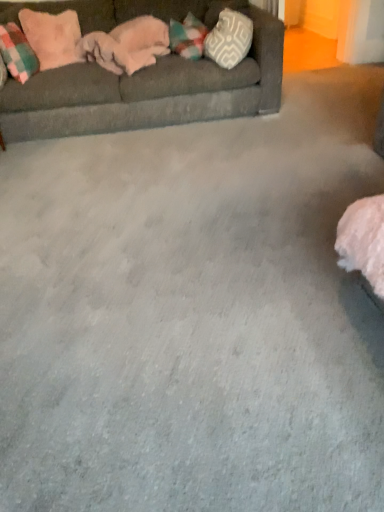
Question: Is white textured pillow at upper right, which is the first pillow in right-to-left order, bigger than pink plush pillow at upper left, the 2th pillow when ordered from right to left?

Choices:
 (A) yes
 (B) no

Answer: (A)

Question: Considering the relative sizes of white textured pillow at upper right, placed as the third pillow when sorted from left to right, and pink plush pillow at upper left, which ranks as the 2th pillow in left-to-right order, in the image provided, is white textured pillow at upper right, placed as the third pillow when sorted from left to right, smaller than pink plush pillow at upper left, which ranks as the 2th pillow in left-to-right order,?

Choices:
 (A) yes
 (B) no

Answer: (B)

Question: From the image's perspective, is white textured pillow at upper right, placed as the third pillow when sorted from left to right, on pink plush pillow at upper left, which ranks as the 2th pillow in left-to-right order?

Choices:
 (A) yes
 (B) no

Answer: (B)

Question: Can you confirm if white textured pillow at upper right, placed as the third pillow when sorted from left to right, is thinner than pink plush pillow at upper left, the 2th pillow when ordered from right to left?

Choices:
 (A) yes
 (B) no

Answer: (B)

Question: Can you confirm if white textured pillow at upper right, which is the first pillow in right-to-left order, is positioned to the left of pink plush pillow at upper left, the 2th pillow when ordered from right to left?

Choices:
 (A) no
 (B) yes

Answer: (A)

Question: From a real-world perspective, relative to white textured pillow at upper right, placed as the third pillow when sorted from left to right, is pink plush pillow at upper left, which ranks as the 2th pillow in left-to-right order, vertically above or below?

Choices:
 (A) below
 (B) above

Answer: (B)

Question: Is pink plush pillow at upper left, the 2th pillow when ordered from right to left, bigger or smaller than white textured pillow at upper right, which is the first pillow in right-to-left order?

Choices:
 (A) big
 (B) small

Answer: (B)

Question: Would you say pink plush pillow at upper left, the 2th pillow when ordered from right to left, is to the left or to the right of white textured pillow at upper right, which is the first pillow in right-to-left order, in the picture?

Choices:
 (A) right
 (B) left

Answer: (B)

Question: Is point (34, 25) positioned closer to the camera than point (236, 24)?

Choices:
 (A) farther
 (B) closer

Answer: (A)

Question: Is plaid fabric pillow at left, the third pillow from the right, in front of or behind white textured pillow at upper right, which is the first pillow in right-to-left order, in the image?

Choices:
 (A) behind
 (B) front

Answer: (A)

Question: Looking at the image, does plaid fabric pillow at left, the third pillow from the right, seem bigger or smaller compared to white textured pillow at upper right, which is the first pillow in right-to-left order?

Choices:
 (A) small
 (B) big

Answer: (A)

Question: Does point (16, 29) appear closer or farther from the camera than point (236, 18)?

Choices:
 (A) farther
 (B) closer

Answer: (A)

Question: Looking at their shapes, would you say plaid fabric pillow at left, the third pillow from the right, is wider or thinner than white textured pillow at upper right, placed as the third pillow when sorted from left to right?

Choices:
 (A) thin
 (B) wide

Answer: (B)

Question: From the image's perspective, is dark gray fabric couch at upper left located above or below white textured pillow at upper right, which is the first pillow in right-to-left order?

Choices:
 (A) above
 (B) below

Answer: (B)

Question: Considering the positions of dark gray fabric couch at upper left and white textured pillow at upper right, placed as the third pillow when sorted from left to right, in the image, is dark gray fabric couch at upper left bigger or smaller than white textured pillow at upper right, placed as the third pillow when sorted from left to right,?

Choices:
 (A) small
 (B) big

Answer: (B)